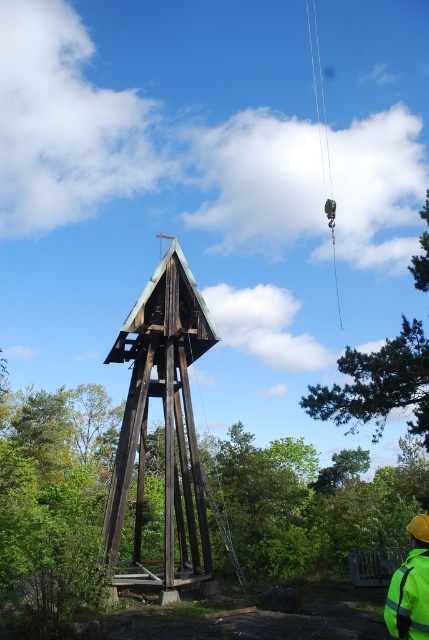
Question: Can you confirm if green leafy tree at upper right is positioned below reflective yellow safety vest at lower right?

Choices:
 (A) yes
 (B) no

Answer: (B)

Question: Considering the real-world distances, which object is closest to the reflective yellow safety vest at lower right?

Choices:
 (A) brown wooden tower at center
 (B) black metal chain at upper center
 (C) green leafy tree at upper right

Answer: (A)

Question: Estimate the real-world distances between objects in this image. Which object is closer to the black metal chain at upper center?

Choices:
 (A) green leafy tree at upper right
 (B) brown wooden tower at center

Answer: (B)

Question: Is green leafy tree at upper right to the right of black metal chain at upper center from the viewer's perspective?

Choices:
 (A) no
 (B) yes

Answer: (B)

Question: Among these objects, which one is nearest to the camera?

Choices:
 (A) brown wooden tower at center
 (B) black metal chain at upper center
 (C) green leafy tree at upper right
 (D) reflective yellow safety vest at lower right

Answer: (D)

Question: Is brown wooden tower at center positioned in front of green leafy tree at upper right?

Choices:
 (A) no
 (B) yes

Answer: (B)